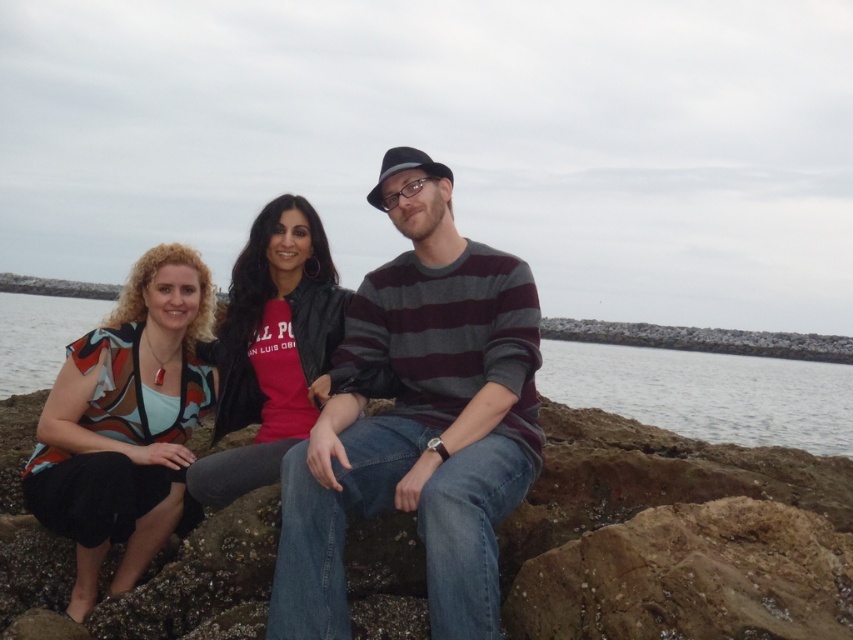
Can you confirm if striped sweater at center is smaller than matte multicolored blouse at left?

No, striped sweater at center is not smaller than matte multicolored blouse at left.

Is striped sweater at center to the right of matte multicolored blouse at left from the viewer's perspective?

Correct, you'll find striped sweater at center to the right of matte multicolored blouse at left.

This screenshot has height=640, width=853. What are the coordinates of `striped sweater at center` in the screenshot? It's located at (416, 419).

Does striped sweater at center have a lesser height compared to clear water at center?

Yes.

Does point (488, 275) come behind point (1, 368)?

That is False.

Locate an element on the screen. This screenshot has width=853, height=640. striped sweater at center is located at coordinates (416, 419).

Locate an element on the screen. striped sweater at center is located at coordinates (416, 419).

Can you confirm if matte multicolored blouse at left is positioned to the right of matte black jacket at center?

Incorrect, matte multicolored blouse at left is not on the right side of matte black jacket at center.

Which is above, matte multicolored blouse at left or matte black jacket at center?

matte black jacket at center is higher up.

I want to click on matte multicolored blouse at left, so click(x=126, y=422).